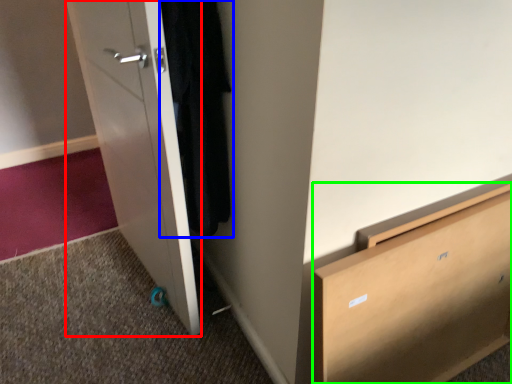
Question: Which is farther away from door (highlighted by a red box)? clothing (highlighted by a blue box) or chest of drawers (highlighted by a green box)?

Choices:
 (A) clothing
 (B) chest of drawers

Answer: (B)